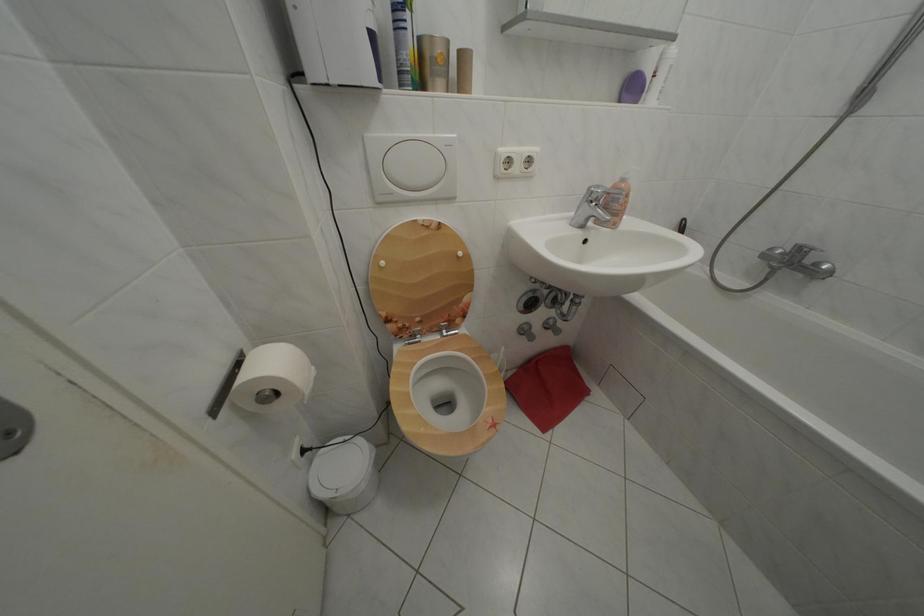
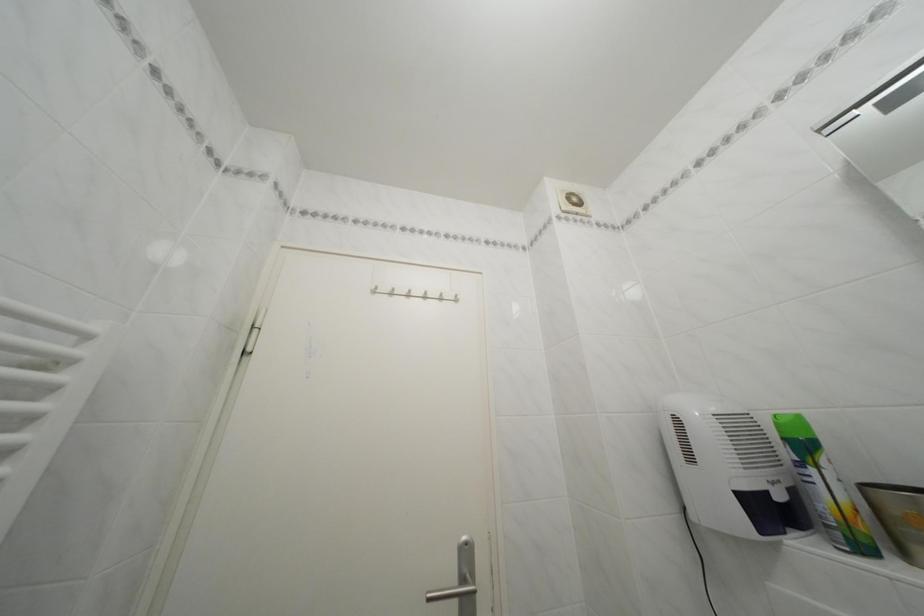
The images are taken continuously from a first-person perspective. In which direction is your viewpoint rotating?

The rotation direction of the camera is left-up.